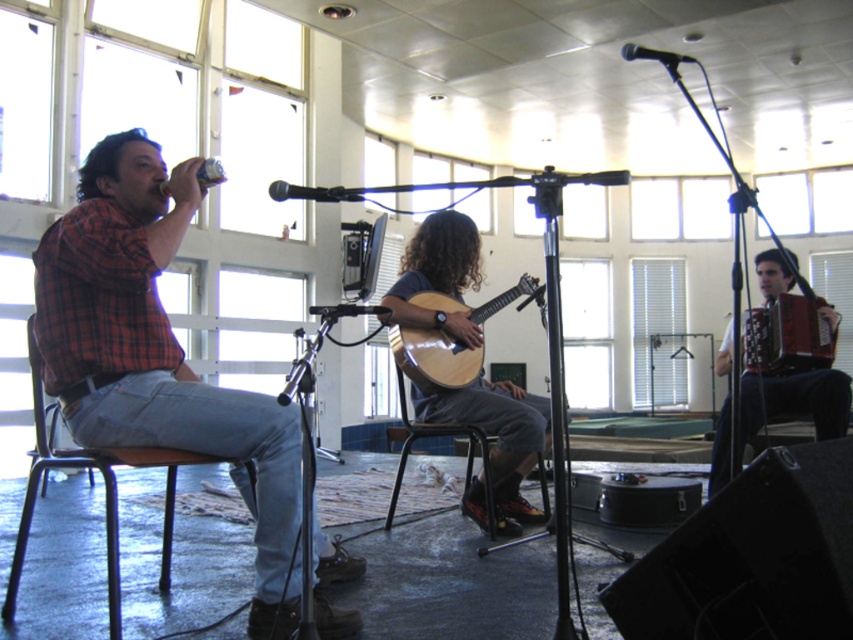
Who is higher up, wooden acoustic guitar at center or black matte microphone at upper center?

black matte microphone at upper center is higher up.

Which of these two, wooden acoustic guitar at center or black matte microphone at upper center, stands taller?

wooden acoustic guitar at center

Is point (426, 301) in front of point (271, 184)?

No, it is not.

I want to click on wooden acoustic guitar at center, so click(434, 356).

Between point (846, 420) and point (489, 305), which one is positioned behind?

The point (846, 420) is behind.

At what (x,y) coordinates should I click in order to perform the action: click on matte brown accordion at right. Please return your answer as a coordinate pair (x, y). Looking at the image, I should click on (796, 401).

The image size is (853, 640). I want to click on black plastic accordion at right, so click(x=787, y=337).

This screenshot has height=640, width=853. In order to click on black plastic accordion at right in this screenshot , I will do tap(787, 337).